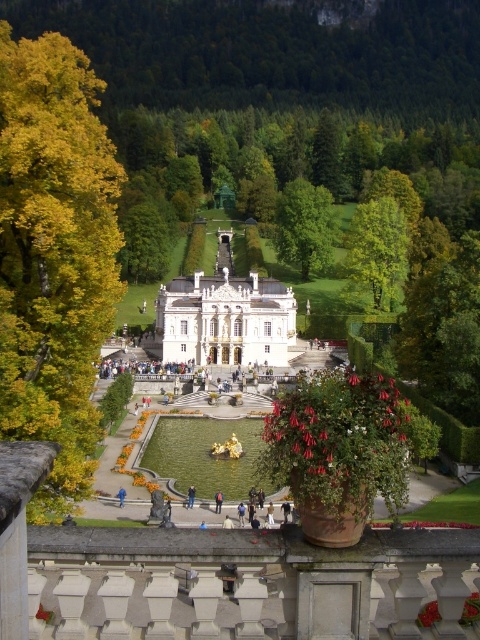
Does point (216, 500) come farther from viewer compared to point (192, 486)?

No, (216, 500) is in front of (192, 486).

Is point (217, 502) positioned after point (192, 493)?

No, it is not.

In order to click on blue fabric jacket at center in this screenshot , I will do `click(217, 500)`.

Does blue jeans at lower center have a lesser width compared to blue fabric person at center?

Incorrect, blue jeans at lower center's width is not less than blue fabric person at center's.

Does point (192, 499) come closer to viewer compared to point (121, 497)?

No, (192, 499) is behind (121, 497).

Locate an element on the screen. This screenshot has width=480, height=640. blue jeans at lower center is located at coordinates (191, 497).

Does green leafy tree at upper center have a greater width compared to blue fabric jacket at center?

Yes.

Which is in front, point (354, 253) or point (219, 500)?

Point (219, 500) is in front.

Find the location of a particular element. The width and height of the screenshot is (480, 640). green leafy tree at upper center is located at coordinates (375, 250).